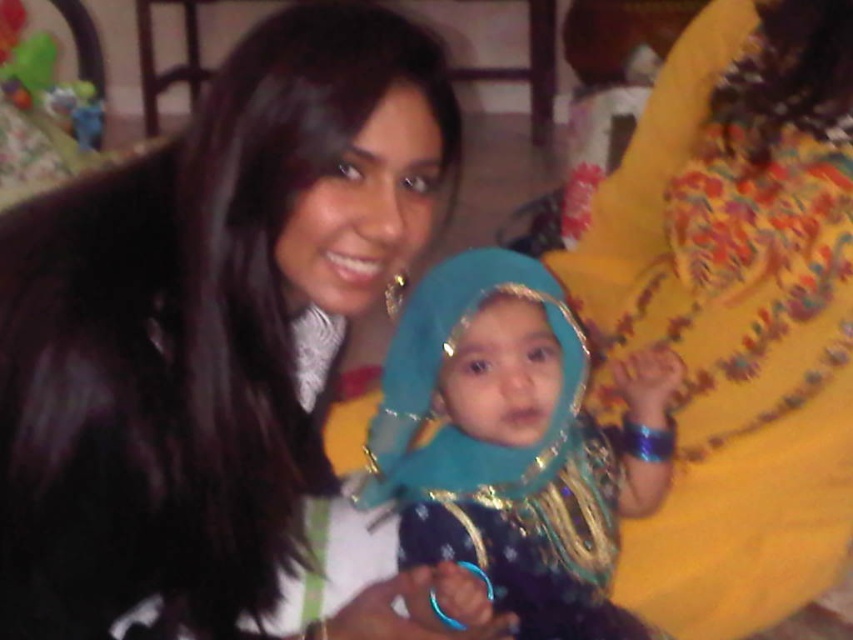
You are a guest at a party and see the black fur coat at center and the shiny blue fabric at center in the room. Which object is placed higher?

The black fur coat at center is located above the shiny blue fabric at center, so it is placed higher.

You are an interior designer assessing the placement of fabrics in a room. You notice the yellow embroidered dress at right and the shiny blue fabric at center. Which object is placed above the other?

The yellow embroidered dress at right is positioned over the shiny blue fabric at center, meaning it is placed above the shiny blue fabric at center.

You are organizing a fashion show and need to arrange the yellow embroidered dress at right and the shiny blue fabric at center in a display. According to the scene, which object is located to the right of the other?

The yellow embroidered dress at right is positioned on the right side of the shiny blue fabric at center, so it is to the right of the shiny blue fabric at center.